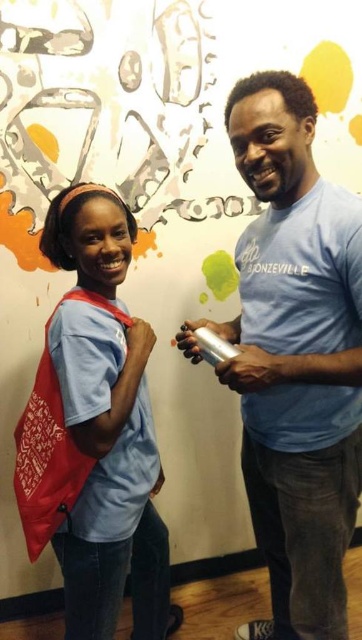
Question: Does metallic canister at right have a larger size compared to matte blue shirt at center?

Choices:
 (A) yes
 (B) no

Answer: (A)

Question: Which point appears closest to the camera in this image?

Choices:
 (A) [262, 397]
 (B) [82, 502]

Answer: (B)

Question: Is metallic canister at right above matte blue shirt at center?

Choices:
 (A) no
 (B) yes

Answer: (B)

Question: Which object is closer to the camera taking this photo?

Choices:
 (A) metallic canister at right
 (B) matte blue shirt at center

Answer: (A)

Question: Which object appears closest to the camera in this image?

Choices:
 (A) matte blue shirt at center
 (B) metallic canister at right

Answer: (B)

Question: Can you confirm if metallic canister at right is positioned to the right of matte blue shirt at center?

Choices:
 (A) yes
 (B) no

Answer: (A)